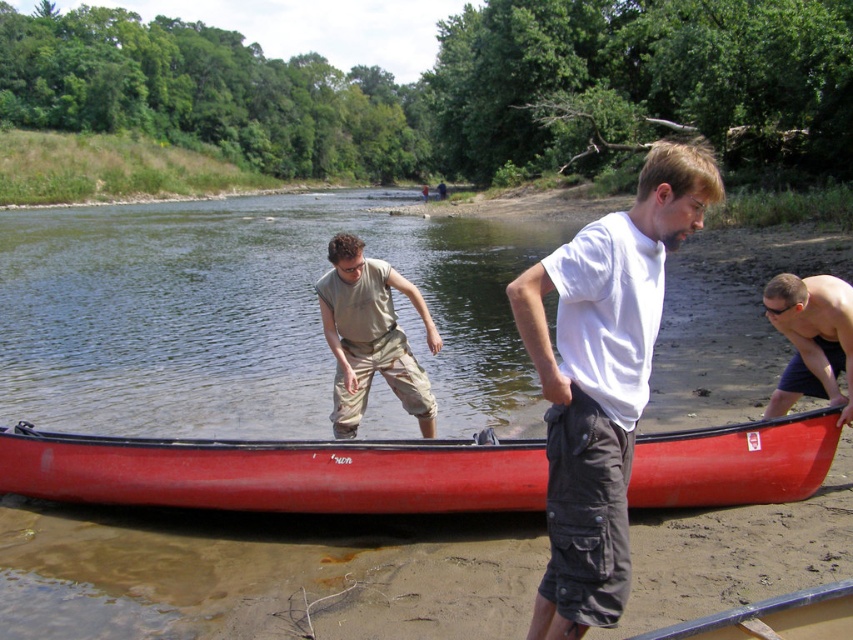
You are a photographer capturing the scene from the riverbank. You notice the khaki cotton pants at center and the shiny black skin at lower right. Which object is closer to the photographer?

The khaki cotton pants at center is closer to the photographer because the shiny black skin at lower right is positioned behind it.

You are planning to take a short boat trip on the river. The shiny red canoe at center is available. Considering its size relative to the white cotton shirt at center, do you think it can comfortably fit two adults?

The shiny red canoe at center is smaller than the white cotton shirt at center. Since the canoe is smaller, it may not have enough space to comfortably fit two adults.

You are a photographer trying to capture a clear shot of the khaki cotton pants at center and the shiny black skin at lower right. Which object is wider in the image?

The khaki cotton pants at center might be wider than shiny black skin at lower right.